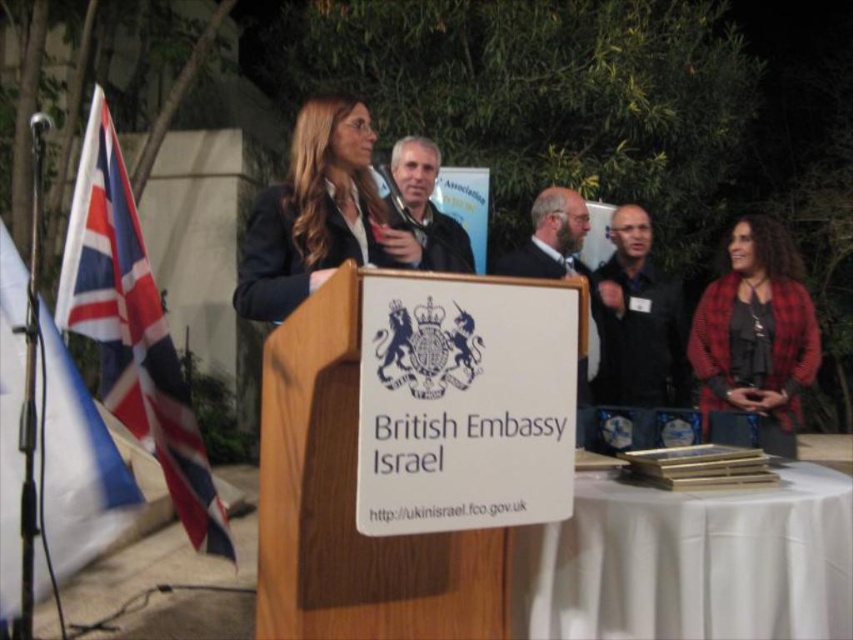
You are attending the British Embassy event and need to locate the guest of honor. According to the scene, which person is taller between the red plaid shirt at right and the dark suit at center?

The red plaid shirt at right is taller than the dark suit at center, so the guest of honor is likely the person wearing the red plaid shirt at right.